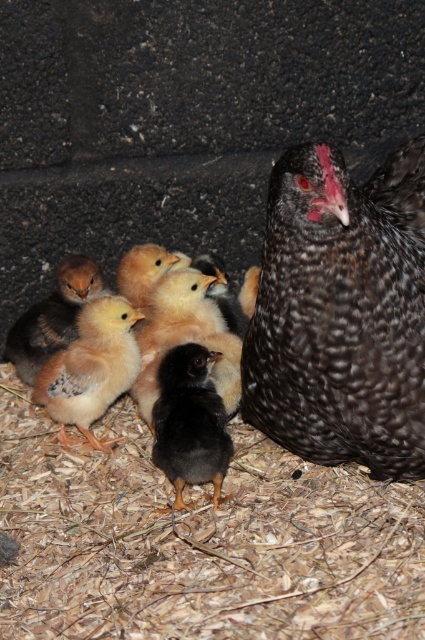
You are a farmer checking on your poultry. You notice the speckled feathered hen at center and the light yellow downy chick at center. Which one is above the other?

The speckled feathered hen at center is positioned over light yellow downy chick at center.

You are a farmer checking on your poultry. You see the speckled feathered hen at center and the yellow downy chick at left. Which animal is taller?

The speckled feathered hen at center is taller than the yellow downy chick at left.